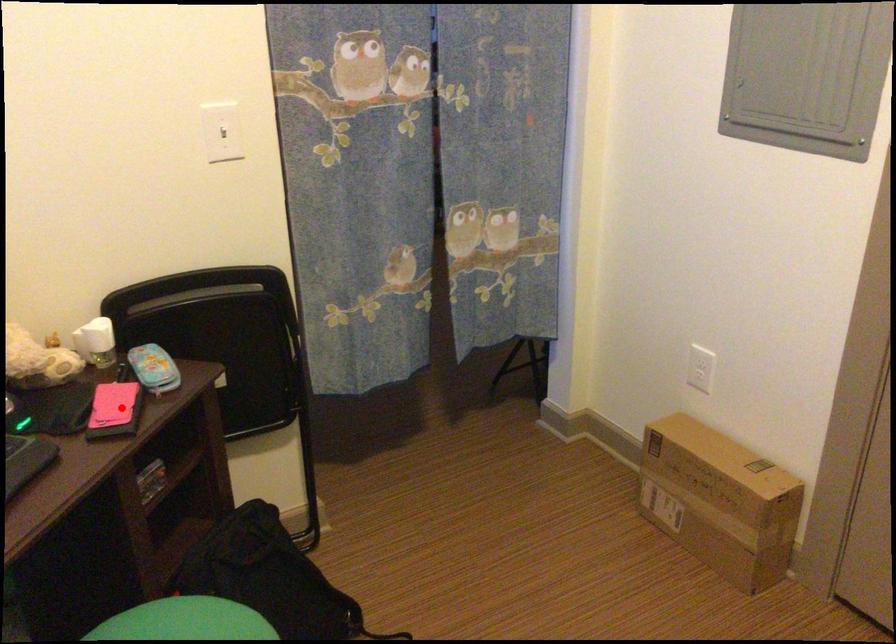
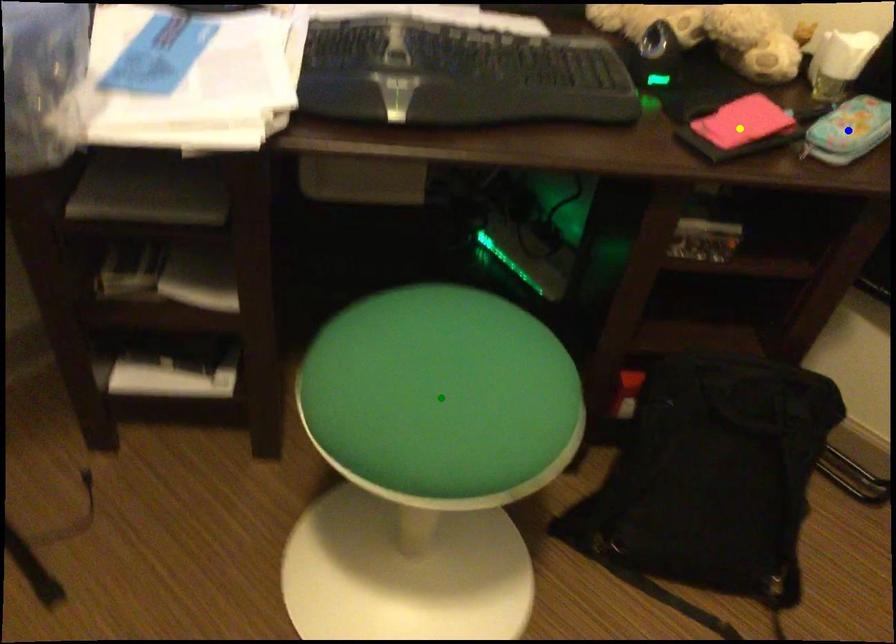
Question: I am providing you with two images of the same scene from different viewpoints. A red point is marked on the first image. You are given multiple points on the second image. Which point in image 2 represents the same 3d spot as the red point in image 1?

Choices:
 (A) green point
 (B) yellow point
 (C) blue point

Answer: (B)